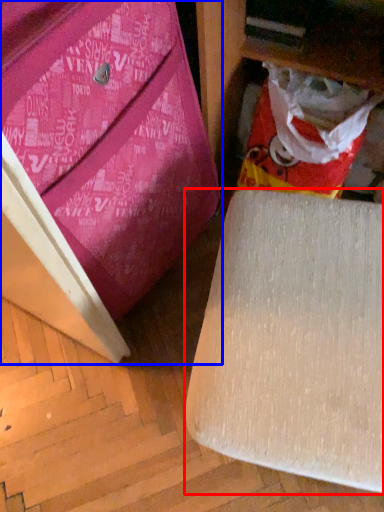
Question: Which point is further to the camera, furniture (highlighted by a red box) or furniture (highlighted by a blue box)?

Choices:
 (A) furniture
 (B) furniture

Answer: (A)